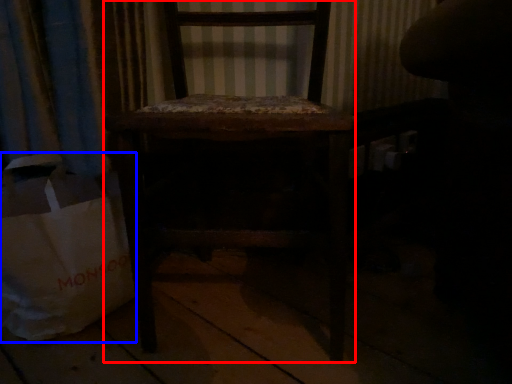
Question: Which object appears farthest to the camera in this image, chair (highlighted by a red box) or grocery bag (highlighted by a blue box)?

Choices:
 (A) chair
 (B) grocery bag

Answer: (B)